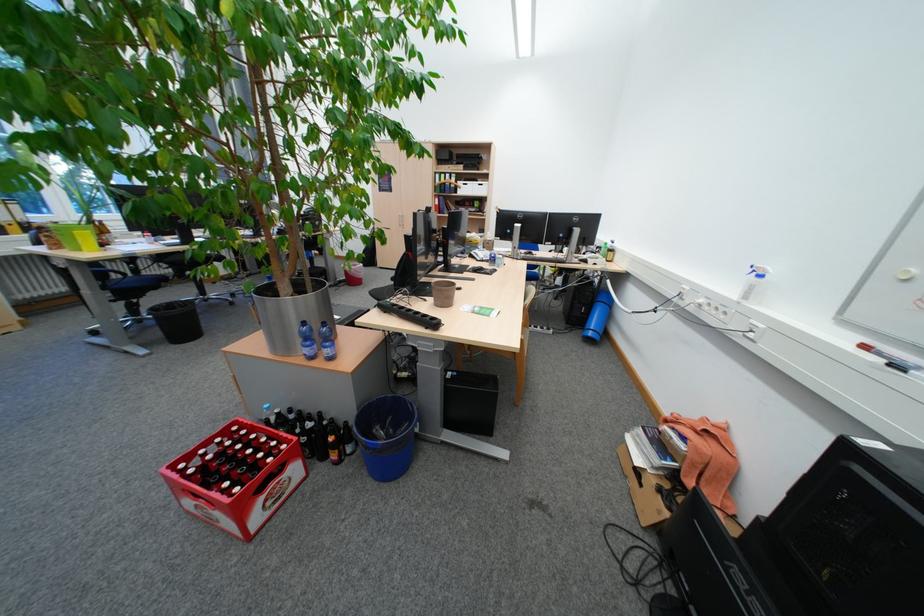
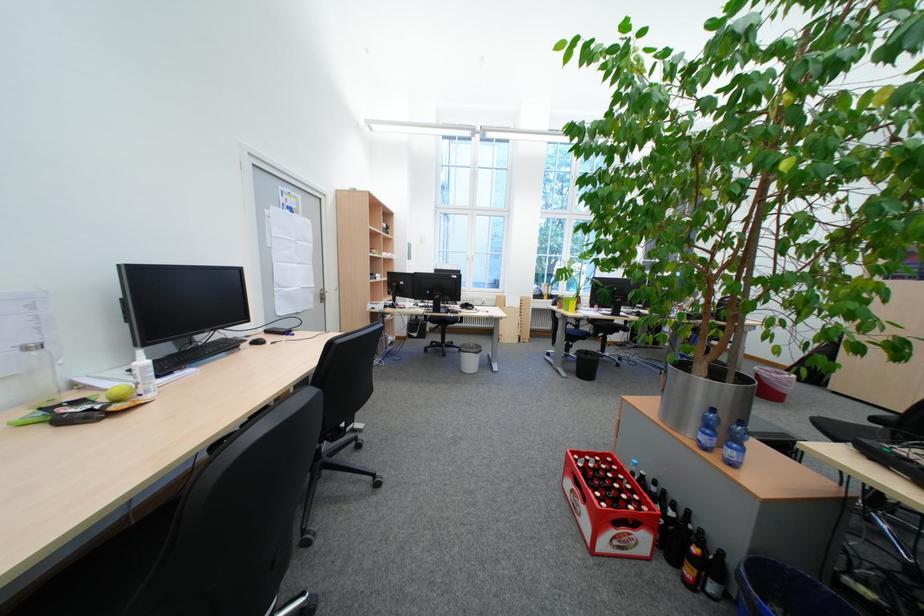
Find the pixel in the second image that matches [370,445] in the first image.

(738, 597)